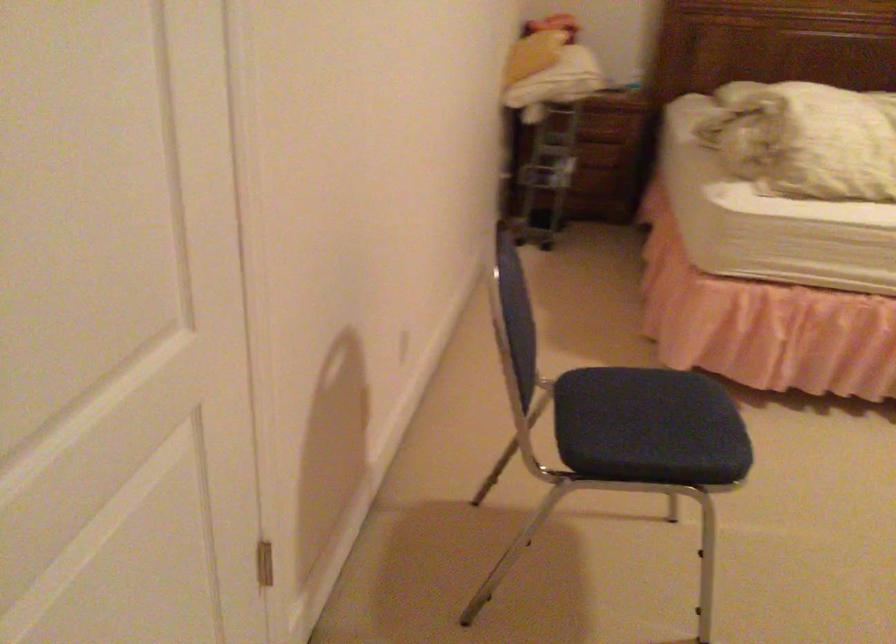
Find where to sit the blue chair sitting surface. Please return your answer as a coordinate pair (x, y).

(650, 433)